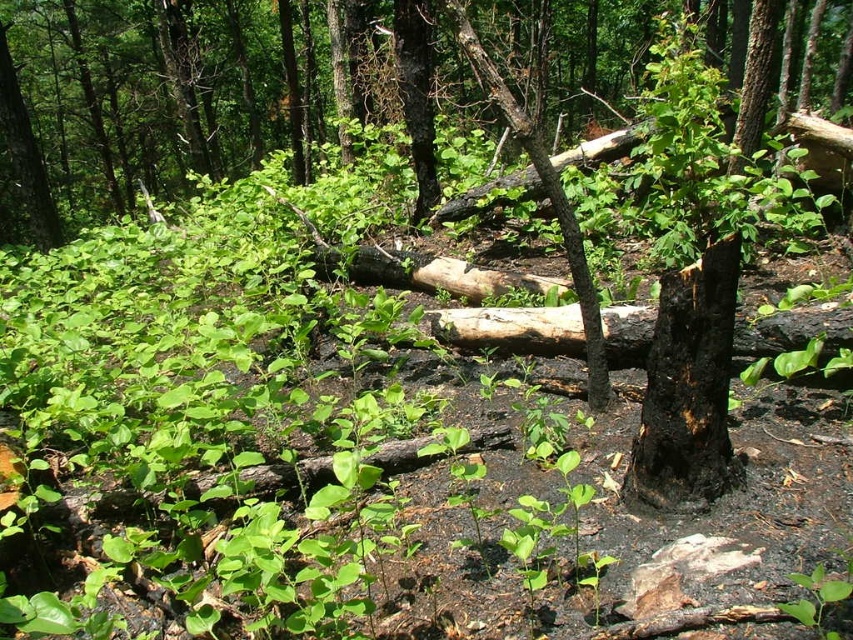
You are a hiker who has just entered the forest and wants to reach the green leafy tree at center. If you are standing at the origin point, which is the starting point of your hike, what are the coordinates you need to move to in order to reach the tree?

The coordinates to reach the green leafy tree at center are point (148, 99).

From the picture: You are a hiker in the forest and want to find the tallest object between the green leafy tree at center and the charcoal black bark at center. Which one should you look at?

The green leafy tree at center is taller than the charcoal black bark at center, so you should look at the green leafy tree at center.

From the picture: You are a botanist studying the regrowth of vegetation after a fire. You observe the green leafy tree at center and the charcoal black bark at center. Which of these two objects is bigger in size?

The green leafy tree at center is larger in size than the charcoal black bark at center.